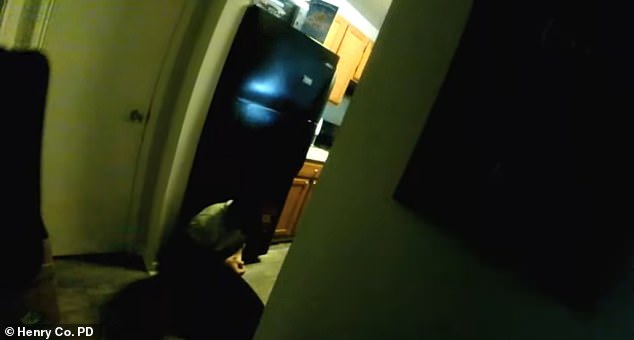
Where is `freezer door`? freezer door is located at coordinates (292, 59).